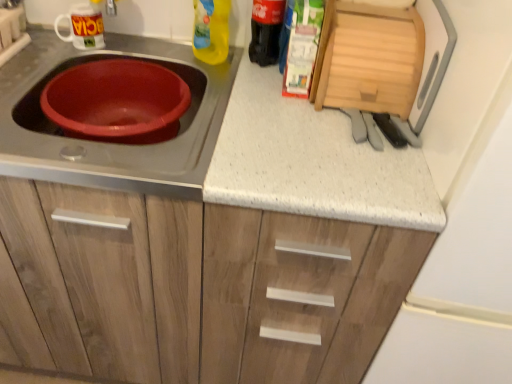
I want to click on free region on the left part of black glass bottle at upper right, positioned as the 1th bottle in right-to-left order, so click(223, 57).